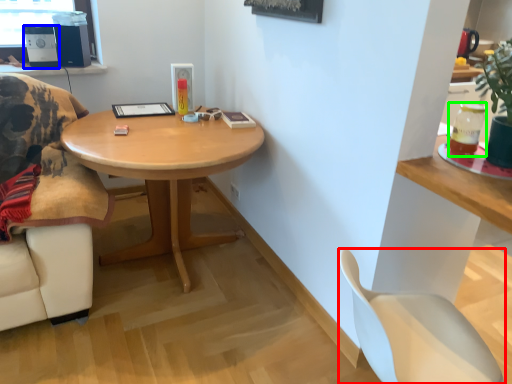
Question: Based on their relative distances, which object is farther from chair (highlighted by a red box)? Choose from speaker (highlighted by a blue box) and beverage (highlighted by a green box).

Choices:
 (A) speaker
 (B) beverage

Answer: (A)